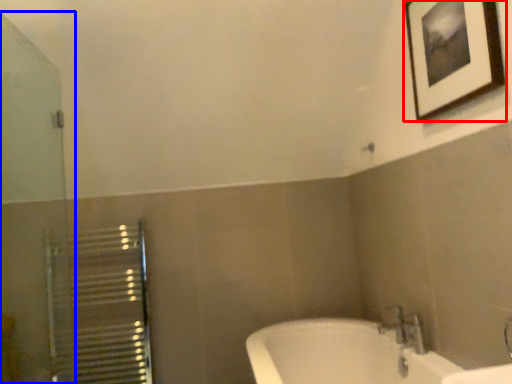
Question: Which object is further to the camera taking this photo, picture frame (highlighted by a red box) or screen door (highlighted by a blue box)?

Choices:
 (A) picture frame
 (B) screen door

Answer: (A)